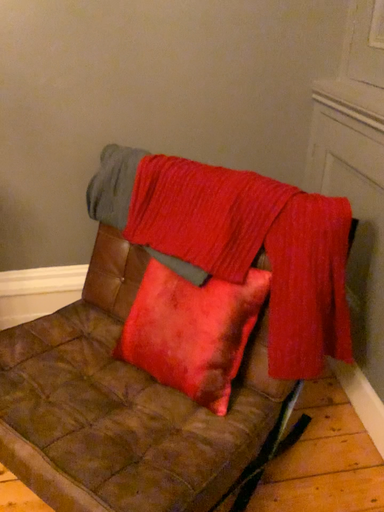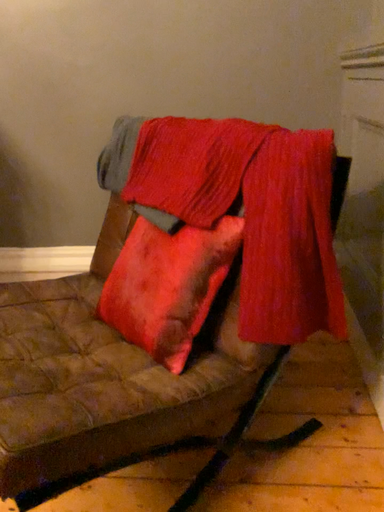
Question: Which way did the camera rotate in the video?

Choices:
 (A) rotated left
 (B) rotated right

Answer: (A)